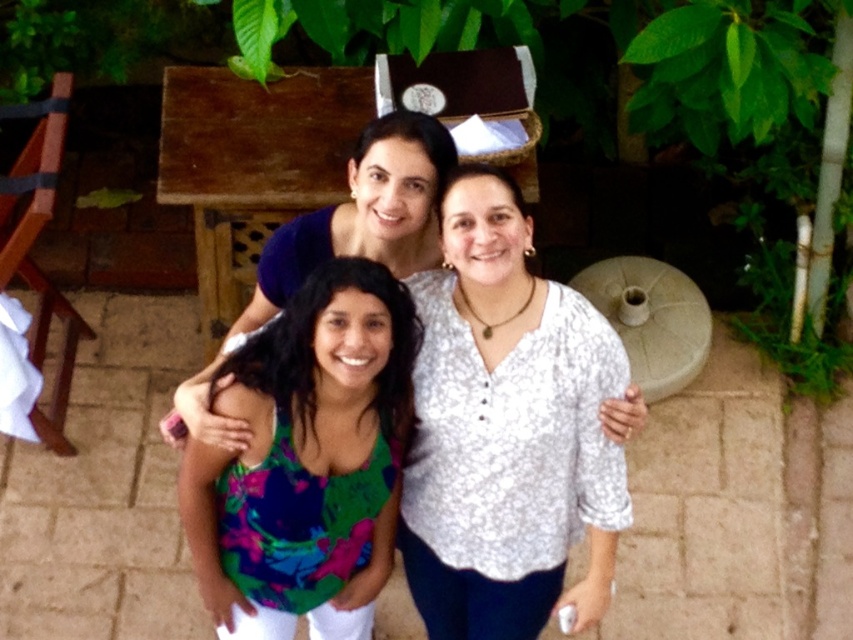
Based on the scene description, which object is positioned to the right of the other between the white textured blouse at center and the multicolored fabric top at center?

The white textured blouse at center is positioned to the right of the multicolored fabric top at center.

Looking at the scene, which clothing item is larger in size between the white textured blouse at center and the multicolored fabric top at center?

The white textured blouse at center is bigger than the multicolored fabric top at center.

In the image, there are three people standing together. The person in the center is wearing a white blouse with a floral pattern. The young girl on the left has a sleeveless top with vibrant floral designs, and the adult on the right is in a dark top. There is a point at coordinates (506, 429). Which object from the scene does this point correspond to?

The point at coordinates (506, 429) corresponds to the white textured blouse at center.